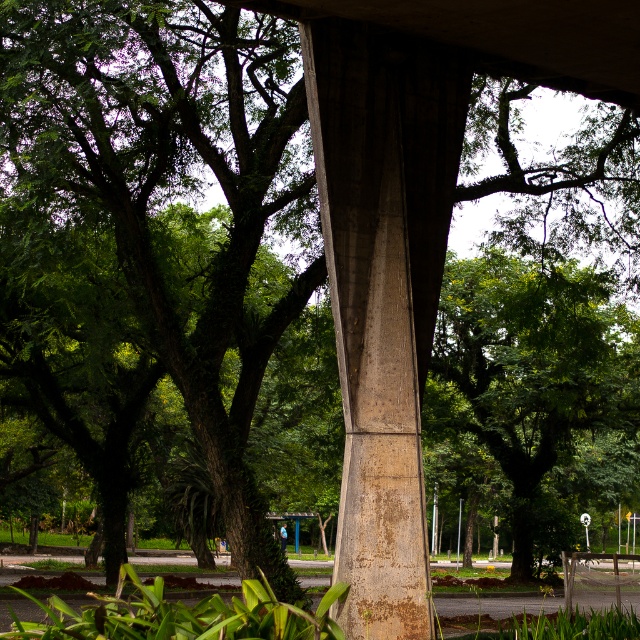
Is rusty concrete pillar at center to the left of concrete at center from the viewer's perspective?

Yes, rusty concrete pillar at center is to the left of concrete at center.

Who is more forward, (385, 544) or (364, 3)?

Positioned in front is point (364, 3).

You are a GUI agent. You are given a task and a screenshot of the screen. Output one action in this format:
    pyautogui.click(x=<x>, y=<y>)
    Task: Click on the rusty concrete pillar at center
    This screenshot has width=640, height=640.
    Given the screenshot: What is the action you would take?
    pyautogui.click(x=369, y=332)

Which is more to the left, green leafy tree at center or rusty concrete pillar at center?

Positioned to the left is rusty concrete pillar at center.

From the picture: Is green leafy tree at center bigger than rusty concrete pillar at center?

Yes.

Which is behind, point (515, 308) or point (419, 579)?

Point (515, 308)

Identify the location of green leafy tree at center. (532, 397).

Does green leafy tree at center have a lesser width compared to concrete at center?

No.

Describe the element at coordinates (532, 397) in the screenshot. I see `green leafy tree at center` at that location.

Where is `green leafy tree at center`? Image resolution: width=640 pixels, height=640 pixels. green leafy tree at center is located at coordinates (532, 397).